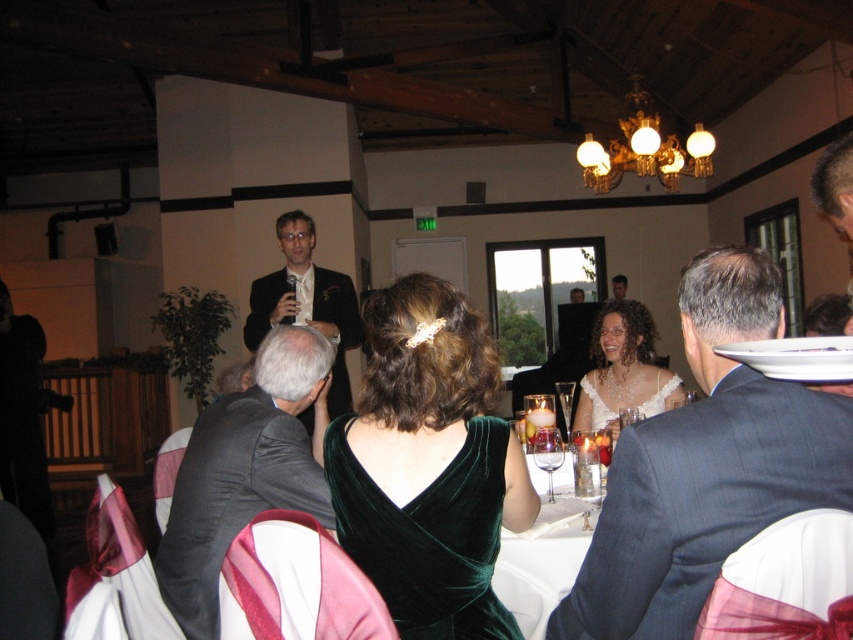
Question: Which is farther from the transparent glass wine glass at center?

Choices:
 (A) matte black suit at upper center
 (B) dark blue suit at center

Answer: (A)

Question: Which point is farther to the camera?

Choices:
 (A) (341, 404)
 (B) (548, 497)

Answer: (A)

Question: Can you confirm if transparent glass wine glass at center is positioned to the right of clear glass wine glass at center?

Choices:
 (A) no
 (B) yes

Answer: (A)

Question: Can you confirm if dark blue suit at center is positioned above matte black suit at upper center?

Choices:
 (A) no
 (B) yes

Answer: (A)

Question: In this image, where is dark gray suit at center located relative to transparent glass wine glass at center?

Choices:
 (A) above
 (B) below

Answer: (A)

Question: Which object is farther from the camera taking this photo?

Choices:
 (A) dark gray suit at center
 (B) white glossy table at center
 (C) matte black suit at upper center
 (D) dark blue suit at center

Answer: (C)